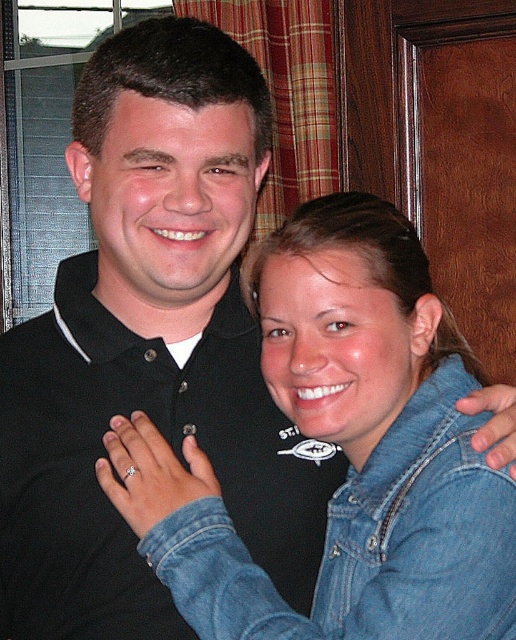
You are an interior designer trying to place a small decorative item at the exact point with coordinates (104,452). Based on the scene description, what object will the item be placed on?

The point at coordinates (104,452) corresponds to the black cotton polo shirt at center, so the decorative item will be placed on the black cotton polo shirt at center.

You are taking a photo of the scene and want to focus on both point (x=20, y=531) and point (x=507, y=580). Which point is closer to the camera?

Point (x=20, y=531) is closer to the camera than point (x=507, y=580).

You are a photographer setting up for a photo shoot. You need to ensure that the black cotton polo shirt at center and the faded denim jacket at lower right are visible in the frame. Based on their heights, which one might you need to adjust the camera angle to capture fully?

The black cotton polo shirt at center is taller than the faded denim jacket at lower right, so you might need to adjust the camera angle to capture the taller black cotton polo shirt at center fully.